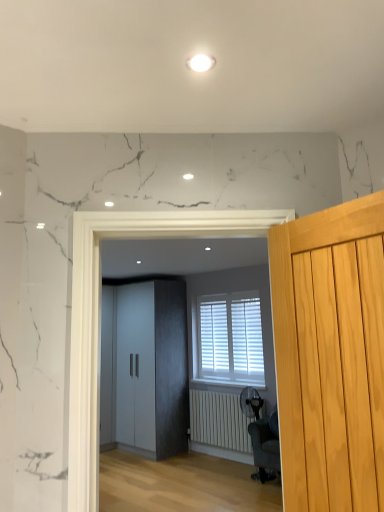
Question: Is the surface of dark gray fabric swivel chair at center in direct contact with light wood door at right?

Choices:
 (A) no
 (B) yes

Answer: (A)

Question: Is dark gray fabric swivel chair at center surrounding light wood door at right?

Choices:
 (A) no
 (B) yes

Answer: (A)

Question: From a real-world perspective, is dark gray fabric swivel chair at center under light wood door at right?

Choices:
 (A) no
 (B) yes

Answer: (B)

Question: Does dark gray fabric swivel chair at center have a smaller size compared to light wood door at right?

Choices:
 (A) yes
 (B) no

Answer: (B)

Question: From the image's perspective, is dark gray fabric swivel chair at center above light wood door at right?

Choices:
 (A) no
 (B) yes

Answer: (A)

Question: Is dark gray fabric swivel chair at center further to camera compared to light wood door at right?

Choices:
 (A) no
 (B) yes

Answer: (B)

Question: Can you confirm if white matte blinds at center is positioned to the right of matte gray wardrobe at center?

Choices:
 (A) no
 (B) yes

Answer: (B)

Question: Can you confirm if white matte blinds at center is smaller than matte gray wardrobe at center?

Choices:
 (A) no
 (B) yes

Answer: (A)

Question: Considering the relative sizes of white matte blinds at center and matte gray wardrobe at center in the image provided, is white matte blinds at center shorter than matte gray wardrobe at center?

Choices:
 (A) no
 (B) yes

Answer: (A)

Question: Is white matte blinds at center closer to the viewer compared to matte gray wardrobe at center?

Choices:
 (A) no
 (B) yes

Answer: (A)

Question: Can you confirm if white matte blinds at center is thinner than matte gray wardrobe at center?

Choices:
 (A) no
 (B) yes

Answer: (A)

Question: Is white matte blinds at center to the left of matte gray wardrobe at center from the viewer's perspective?

Choices:
 (A) yes
 (B) no

Answer: (B)

Question: Is white matte radiator at lower center positioned beyond the bounds of white matte cabinet at center?

Choices:
 (A) no
 (B) yes

Answer: (B)